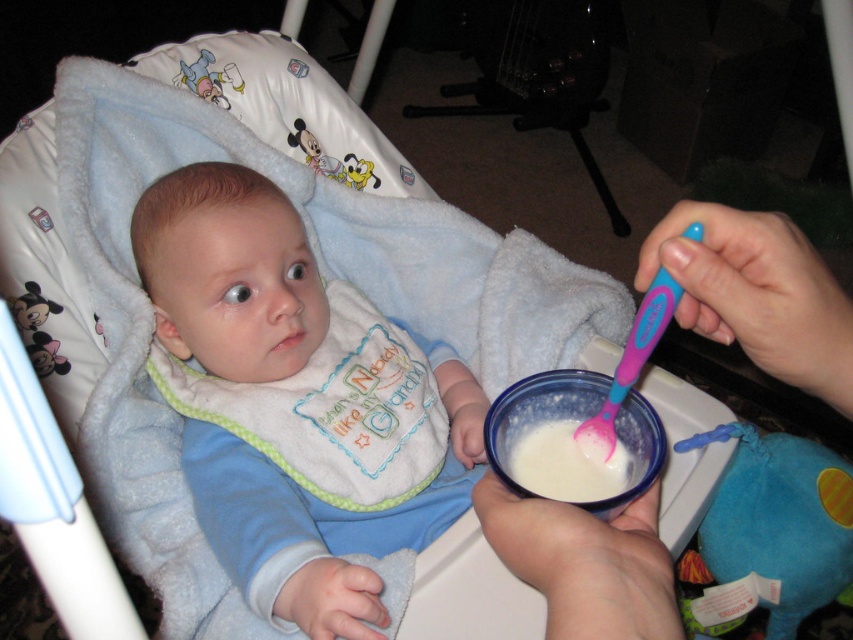
You are a babysitter trying to feed the baby. The baby is currently looking at the blue plush toy at lower right. To get their attention back to the spoon, where should you move the spoon relative to the blue soft bib at center?

Move the spoon above the blue soft bib at center since the blue soft bib at center is already above the blue plush toy at lower right, so moving the spoon there would be closer to the baby and away from the toy.

You are a caregiver trying to feed the baby in the high chair. You see the white plastic bowl at lower center and the pink plastic spoon at upper center. Which object is closer to you?

The white plastic bowl at lower center is closer to you than the pink plastic spoon at upper center because it is further to the viewer.

You are a caregiver trying to feed the baby. You notice the pink plastic spoon at upper center and the blue soft bib at center. Which object is closer to the baby?

The blue soft bib at center is closer to the baby because the pink plastic spoon at upper center is behind it.